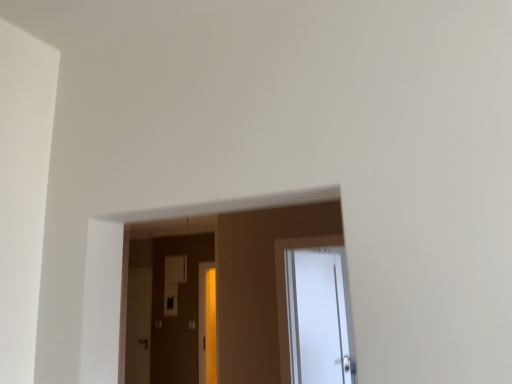
Question: Should I look upward or downward to see matte white screen door at center?

Choices:
 (A) up
 (B) down

Answer: (B)

Question: Does matte white screen door at center have a smaller size compared to white glossy door at center?

Choices:
 (A) no
 (B) yes

Answer: (B)

Question: Can you confirm if matte white screen door at center is thinner than white glossy door at center?

Choices:
 (A) yes
 (B) no

Answer: (A)

Question: Is matte white screen door at center far away from white glossy door at center?

Choices:
 (A) no
 (B) yes

Answer: (B)

Question: From the image's perspective, is matte white screen door at center below white glossy door at center?

Choices:
 (A) yes
 (B) no

Answer: (A)

Question: Considering the relative sizes of matte white screen door at center and white glossy door at center in the image provided, is matte white screen door at center bigger than white glossy door at center?

Choices:
 (A) no
 (B) yes

Answer: (A)

Question: Is matte white screen door at center outside of white glossy door at center?

Choices:
 (A) yes
 (B) no

Answer: (A)

Question: From the image's perspective, is white glossy door at center located beneath matte white screen door at center?

Choices:
 (A) yes
 (B) no

Answer: (B)

Question: Is white glossy door at center closer to camera compared to matte white screen door at center?

Choices:
 (A) yes
 (B) no

Answer: (A)

Question: Is white glossy door at center turned away from matte white screen door at center?

Choices:
 (A) no
 (B) yes

Answer: (A)

Question: Is white glossy door at center taller than matte white screen door at center?

Choices:
 (A) no
 (B) yes

Answer: (A)

Question: Is white glossy door at center wider than matte white screen door at center?

Choices:
 (A) no
 (B) yes

Answer: (B)

Question: Considering the relative positions of white glossy door at center and matte white screen door at center in the image provided, is white glossy door at center to the right of matte white screen door at center from the viewer's perspective?

Choices:
 (A) yes
 (B) no

Answer: (A)

Question: Visually, is white glossy door at center positioned to the left or to the right of matte white screen door at center?

Choices:
 (A) left
 (B) right

Answer: (B)